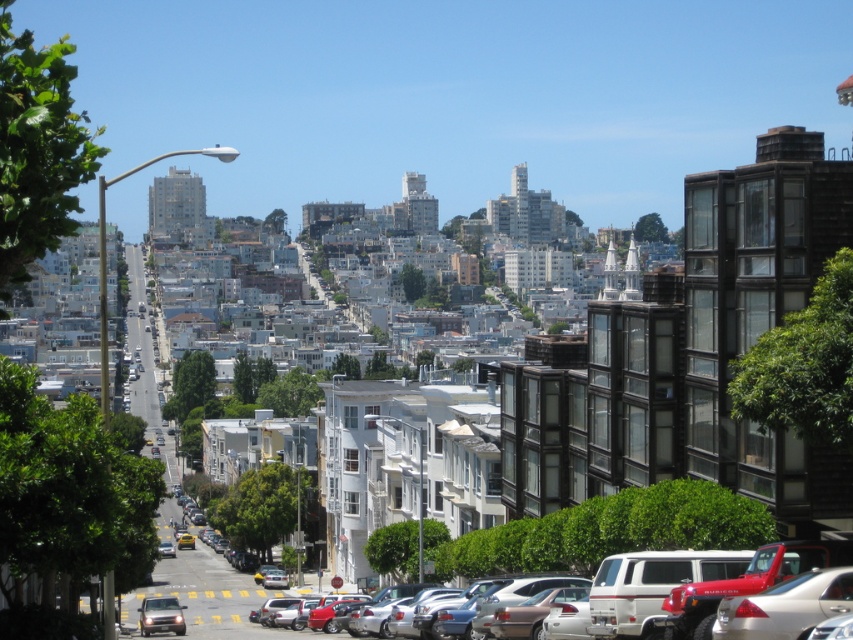
Question: Which of the following is the farthest from the observer?

Choices:
 (A) metallic silver sedan at lower center
 (B) shiny silver suv at lower left

Answer: (B)

Question: Can you confirm if metallic silver sedan at lower center is wider than shiny silver suv at lower left?

Choices:
 (A) yes
 (B) no

Answer: (A)

Question: Can you confirm if metallic silver sedan at lower center is wider than shiny silver suv at lower left?

Choices:
 (A) no
 (B) yes

Answer: (B)

Question: Can you confirm if metallic silver sedan at lower center is positioned below shiny silver suv at lower left?

Choices:
 (A) yes
 (B) no

Answer: (B)